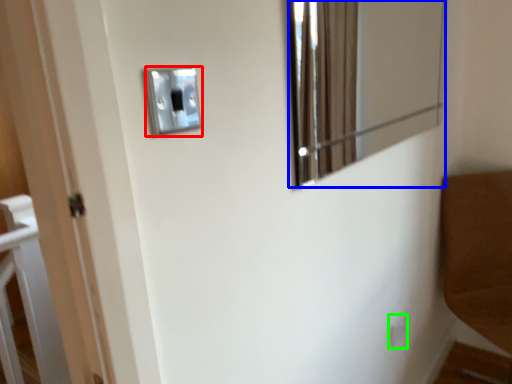
Question: Based on their relative distances, which object is farther from light switch (highlighted by a red box)? Choose from mirror (highlighted by a blue box) and light switch (highlighted by a green box).

Choices:
 (A) mirror
 (B) light switch

Answer: (A)